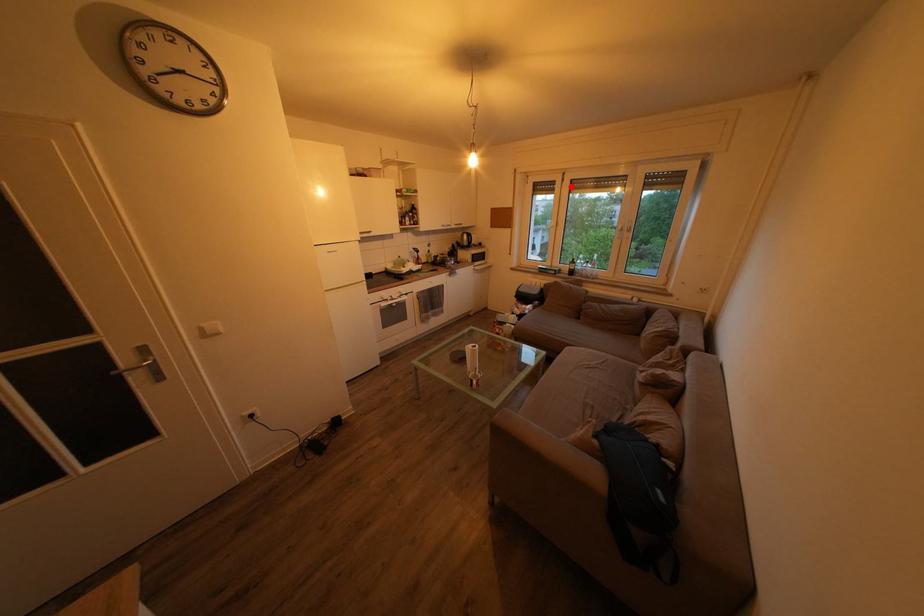
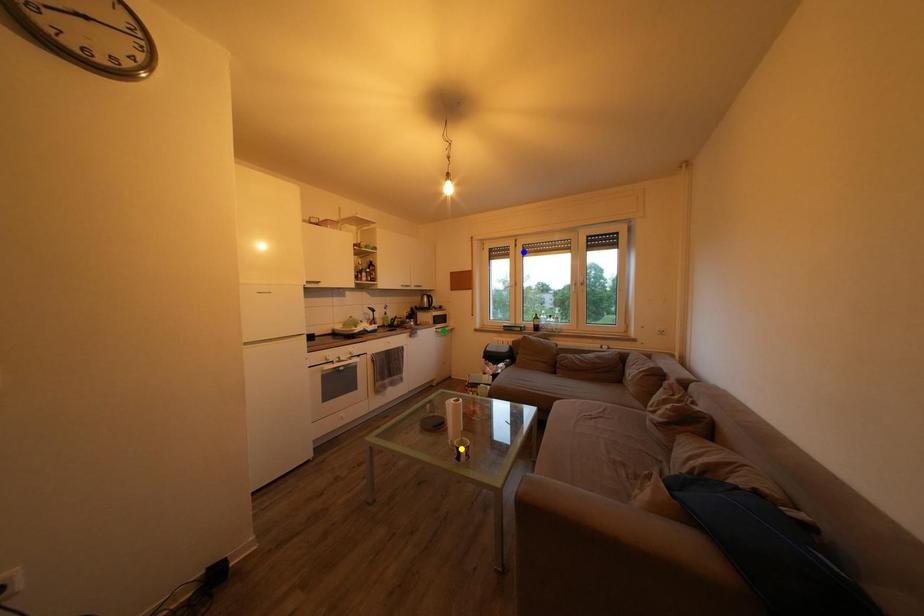
Question: I am providing you with two images of the same scene from different viewpoints. A red point is marked on the first image. You are given multiple points on the second image. Which point in image 2 is actually the same real-world point as the red point in image 1?

Choices:
 (A) green point
 (B) blue point
 (C) yellow point

Answer: (B)